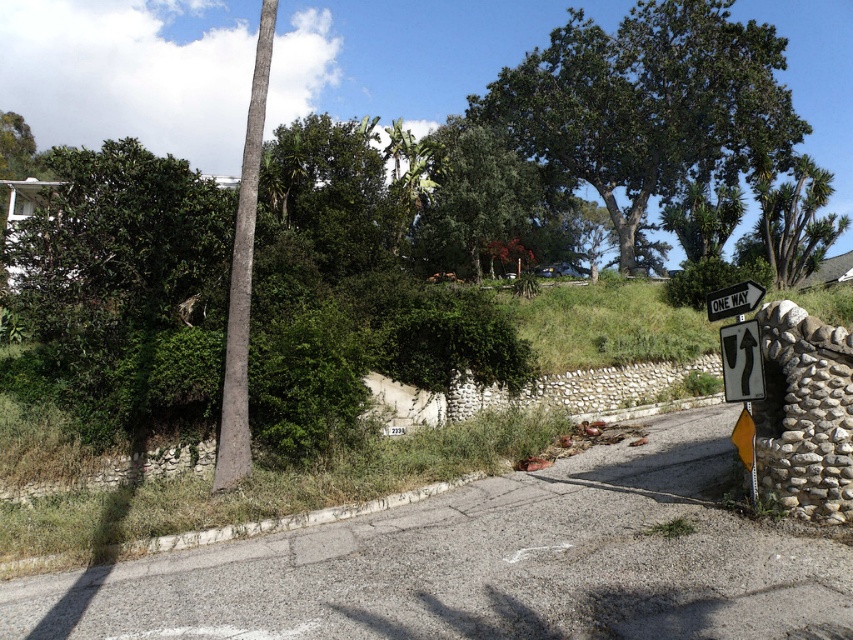
Question: Does white plastic one-way sign at right appear under yellow reflective plastic sign at right?

Choices:
 (A) yes
 (B) no

Answer: (B)

Question: Which point is closer to the camera?

Choices:
 (A) green leafy tree at upper right
 (B) green leafy tree at center
 (C) green leafy tree at upper center

Answer: (A)

Question: Which point is farther from the camera taking this photo?

Choices:
 (A) click(698, 6)
 (B) click(773, 301)
 (C) click(763, 292)

Answer: (A)

Question: Is white plastic one-way sign at right closer to the viewer compared to metallic reflective one way sign at right?

Choices:
 (A) yes
 (B) no

Answer: (A)

Question: Is white plastic one-way sign at right wider than metallic reflective one way sign at right?

Choices:
 (A) no
 (B) yes

Answer: (A)

Question: Based on their relative distances, which object is nearer to the green leafy tree at center?

Choices:
 (A) yellow reflective plastic sign at right
 (B) green leafy tree at upper right

Answer: (B)